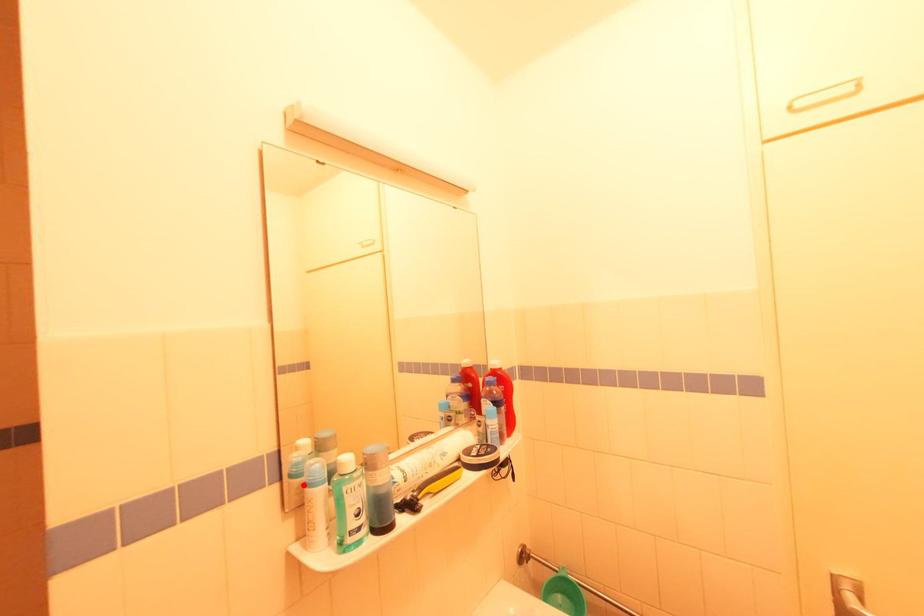
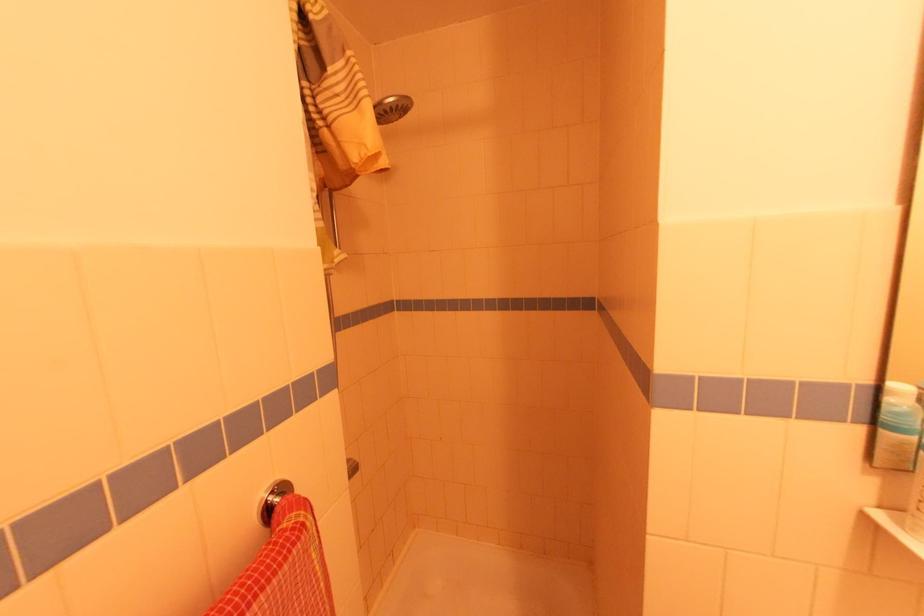
Find the pixel in the second image that matches the highlighted location in the first image.

(906, 445)